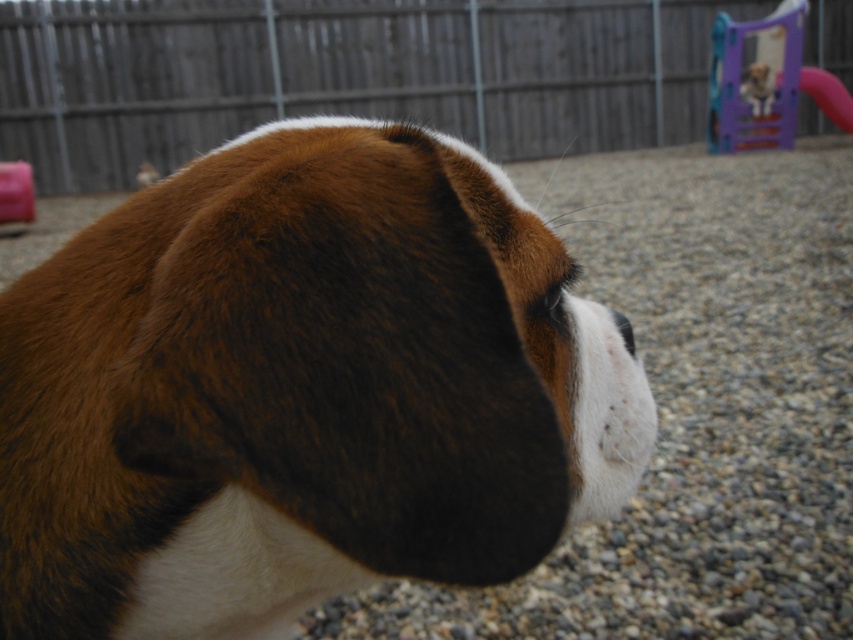
Is point (463, 262) positioned after point (795, 77)?

No, it is not.

Between point (200, 541) and point (728, 61), which one is positioned behind?

The point (728, 61) is behind.

Find the location of a particular element. The height and width of the screenshot is (640, 853). brown furry dog at center is located at coordinates (300, 390).

Is gray gravel at center bigger than plastic purple slide at upper right?

Correct, gray gravel at center is larger in size than plastic purple slide at upper right.

Is gray gravel at center thinner than plastic purple slide at upper right?

Incorrect, gray gravel at center's width is not less than plastic purple slide at upper right's.

Where is `gray gravel at center`? Image resolution: width=853 pixels, height=640 pixels. gray gravel at center is located at coordinates (694, 408).

Describe the element at coordinates (300, 390) in the screenshot. I see `brown furry dog at center` at that location.

Which of these two, brown furry dog at center or gray gravel at center, stands taller?

Standing taller between the two is gray gravel at center.

Is point (337, 120) farther from camera compared to point (730, 236)?

No, (337, 120) is closer to viewer.

At what (x,y) coordinates should I click in order to perform the action: click on brown furry dog at center. Please return your answer as a coordinate pair (x, y). Looking at the image, I should click on (300, 390).